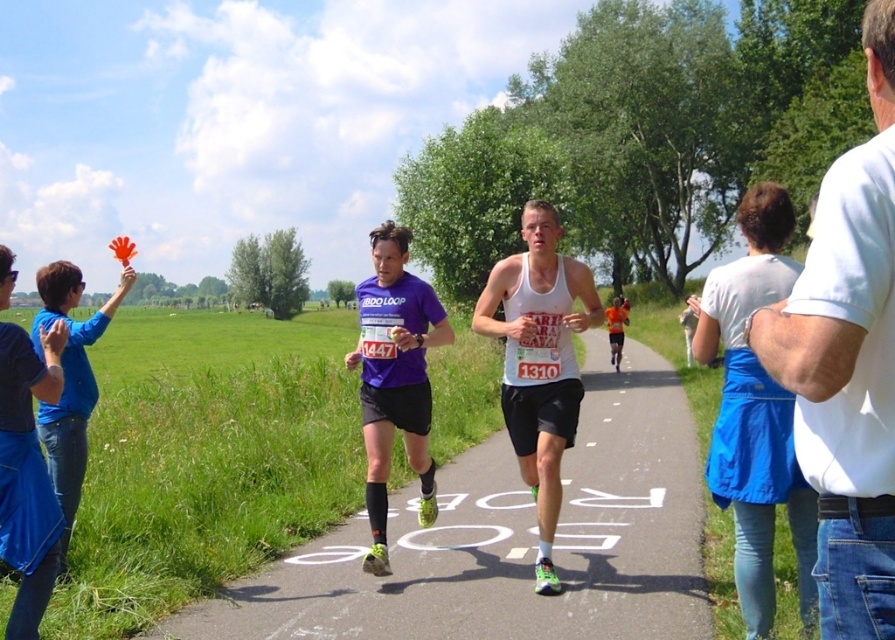
At what (x,y) coordinates should I click in order to perform the action: click on white matte tank top at center. Please return your answer as a coordinate pair (x, y). Looking at the image, I should click on (539, 362).

Which is above, white matte tank top at center or matte blue jacket at left?

white matte tank top at center is above.

The width and height of the screenshot is (895, 640). What do you see at coordinates (539, 362) in the screenshot? I see `white matte tank top at center` at bounding box center [539, 362].

You are a GUI agent. You are given a task and a screenshot of the screen. Output one action in this format:
    pyautogui.click(x=<x>, y=<y>)
    Task: Click on the white matte tank top at center
    
    Given the screenshot: What is the action you would take?
    pyautogui.click(x=539, y=362)

Between blue fabric apron at right and purple fabric shirt at center, which one has less height?

blue fabric apron at right is shorter.

Is blue fabric apron at right further to camera compared to purple fabric shirt at center?

No, blue fabric apron at right is closer to the viewer.

Is point (763, 525) positioned before point (427, 433)?

Yes, point (763, 525) is closer to viewer.

Locate an element on the screen. The width and height of the screenshot is (895, 640). blue fabric apron at right is located at coordinates (755, 413).

Who is more forward, (7, 404) or (66, 368)?

Point (7, 404) is more forward.

Is matte blue jacket at left wider than matte purple shirt at center?

No.

Is point (31, 460) positioned behind point (86, 388)?

No.

Find the location of a particular element. The width and height of the screenshot is (895, 640). matte blue jacket at left is located at coordinates pos(27,472).